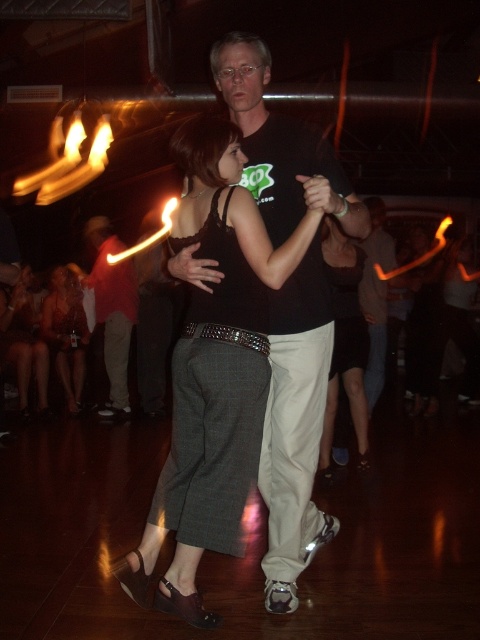
You are a photographer at the event and need to capture a closeup of both the black leather pants at center and the matte black shirt at center. Since your camera can only focus on one object at a time, which object should you choose to ensure it appears larger in the photo?

The black leather pants at center has a smaller size compared to matte black shirt at center. To ensure the object appears larger in the photo, you should choose the matte black shirt at center because it is larger and would fill the frame more effectively when focused on.

You are a photographer at the event and want to capture the dancers in a way that highlights their clothing. Since the dark gray textured pants at center and matte black shirt at center are both central to the composition, which clothing item should you focus on to ensure the pants are visible in the photo?

The dark gray textured pants at center is located below matte black shirt at center, so focusing on the lower part of the dancers will ensure the pants are visible while still capturing the shirt in the frame.